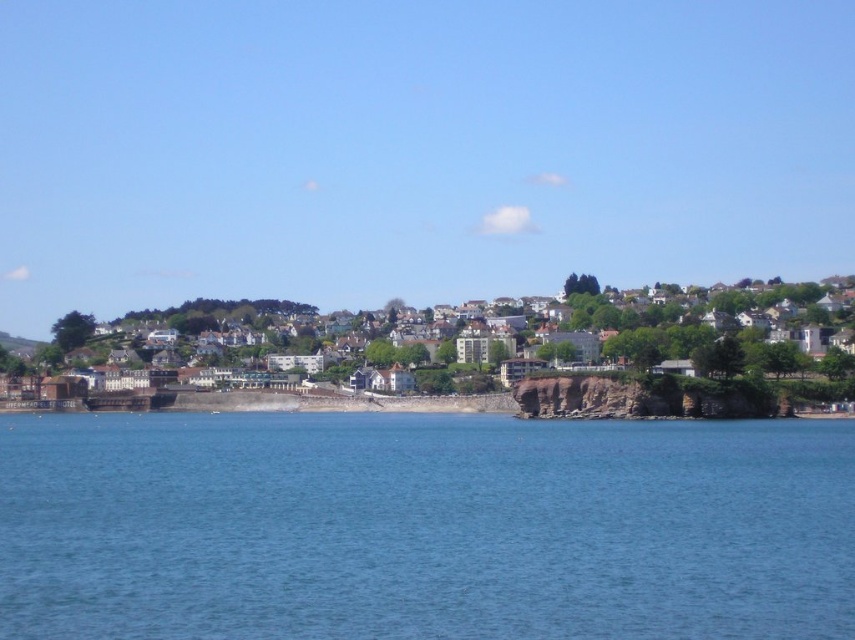
Question: From the image, what is the correct spatial relationship of blue water at lower center in relation to white textured houses at center?

Choices:
 (A) above
 (B) below

Answer: (B)

Question: Among these points, which one is nearest to the camera?

Choices:
 (A) (160, 577)
 (B) (728, 316)

Answer: (A)

Question: Does blue water at lower center come behind white textured houses at center?

Choices:
 (A) yes
 (B) no

Answer: (B)

Question: Can you confirm if blue water at lower center is positioned to the left of white textured houses at center?

Choices:
 (A) no
 (B) yes

Answer: (B)